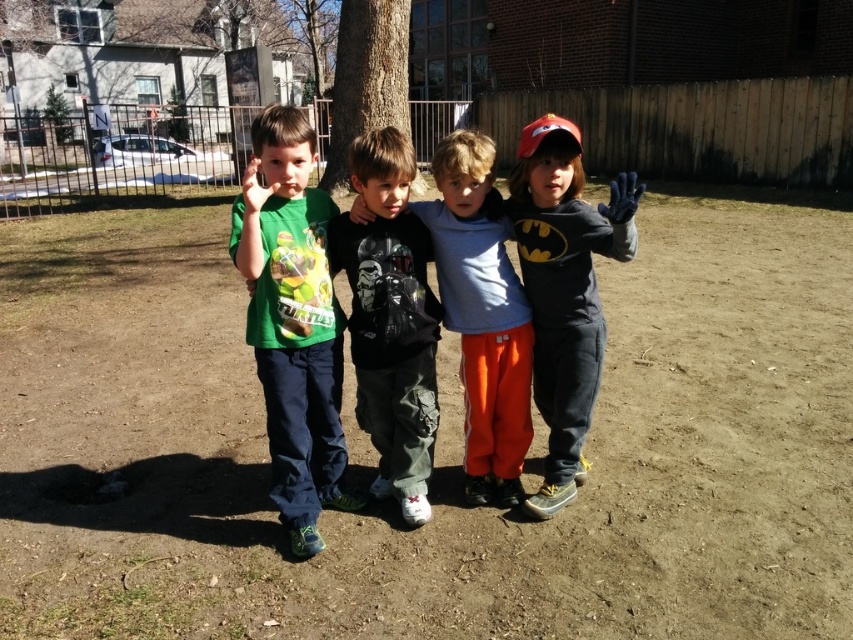
Question: Does brown dirt field at center lie in front of green matte shirt at left?

Choices:
 (A) yes
 (B) no

Answer: (A)

Question: Among these points, which one is farthest from the camera?

Choices:
 (A) (483, 262)
 (B) (648, 221)
 (C) (303, 362)
 (D) (418, 339)

Answer: (B)

Question: Which is farther from the bat signal hoodie at center?

Choices:
 (A) brown dirt field at center
 (B) matte black shirt at center

Answer: (A)

Question: Does bat signal hoodie at center have a larger size compared to matte black shirt at center?

Choices:
 (A) yes
 (B) no

Answer: (B)

Question: Is bat signal hoodie at center wider than dark gray cotton shirt at center?

Choices:
 (A) yes
 (B) no

Answer: (B)

Question: Based on their relative distances, which object is farther from the bat signal hoodie at center?

Choices:
 (A) matte black shirt at center
 (B) brown dirt field at center

Answer: (B)